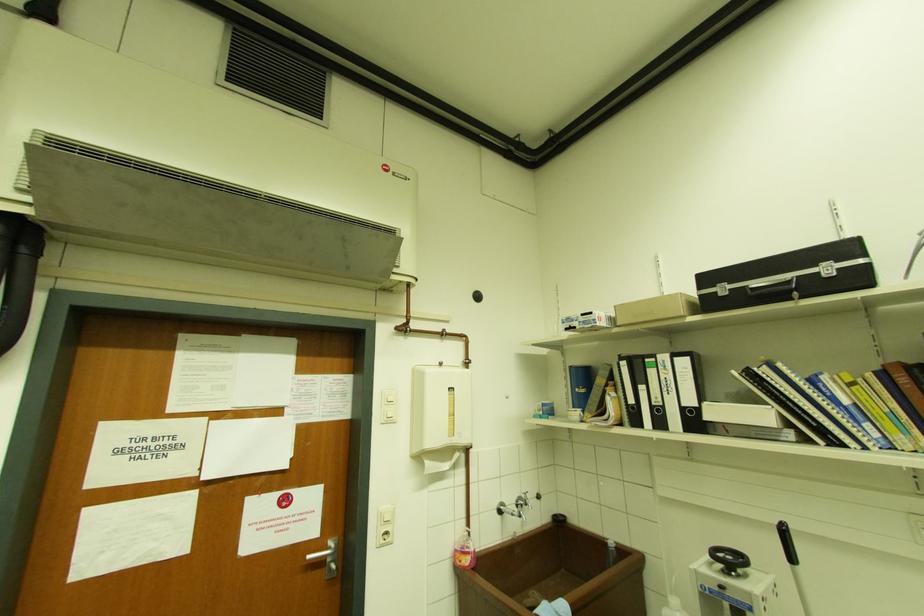
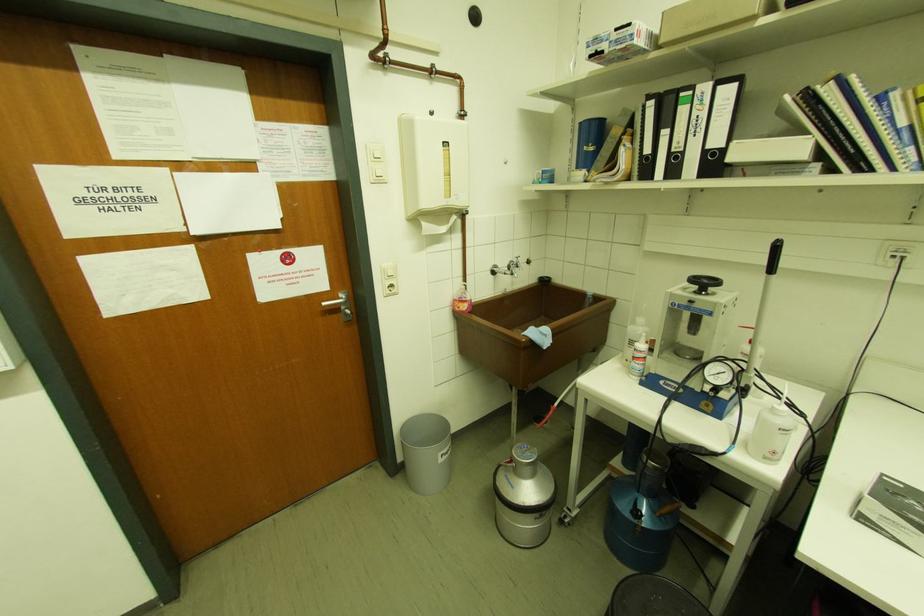
The point at (517, 503) is marked in the first image. Where is the corresponding point in the second image?

(509, 267)